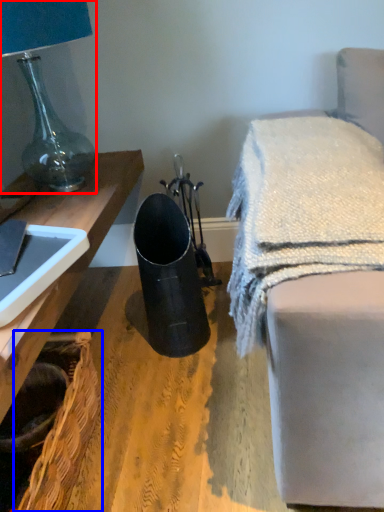
Question: Which point is further to the camera, lamp (highlighted by a red box) or basket (highlighted by a blue box)?

Choices:
 (A) lamp
 (B) basket

Answer: (A)